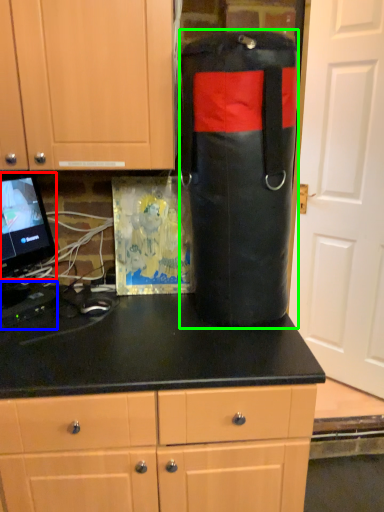
Question: Estimate the real-world distances between objects in this image. Which object is farther from computer monitor (highlighted by a red box), appliance (highlighted by a blue box) or punching bag (highlighted by a green box)?

Choices:
 (A) appliance
 (B) punching bag

Answer: (B)